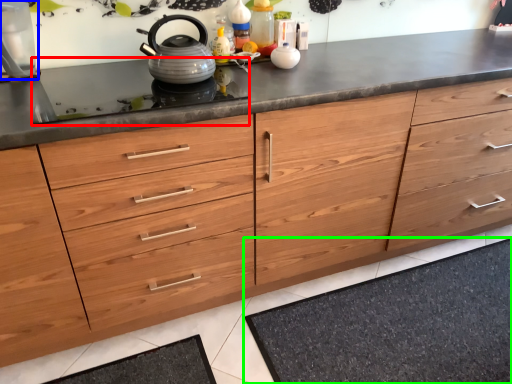
Question: Which object is positioned farthest from gas stove (highlighted by a red box)? Select from appliance (highlighted by a blue box) and bath mat (highlighted by a green box).

Choices:
 (A) appliance
 (B) bath mat

Answer: (B)